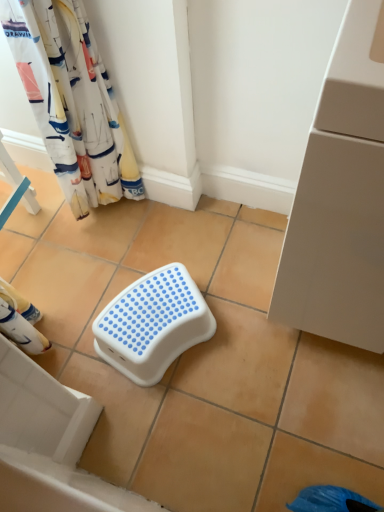
Question: Is white plastic step stool at center bigger or smaller than white fabric curtain at upper left?

Choices:
 (A) big
 (B) small

Answer: (B)

Question: Would you say white plastic step stool at center is to the left or to the right of white fabric curtain at upper left in the picture?

Choices:
 (A) left
 (B) right

Answer: (B)

Question: Does point (165, 276) appear closer or farther from the camera than point (4, 15)?

Choices:
 (A) closer
 (B) farther

Answer: (B)

Question: From a real-world perspective, is white fabric curtain at upper left positioned above or below white plastic step stool at center?

Choices:
 (A) above
 (B) below

Answer: (A)

Question: Looking at their shapes, would you say white fabric curtain at upper left is wider or thinner than white plastic step stool at center?

Choices:
 (A) thin
 (B) wide

Answer: (A)

Question: Considering the positions of white fabric curtain at upper left and white plastic step stool at center in the image, is white fabric curtain at upper left bigger or smaller than white plastic step stool at center?

Choices:
 (A) big
 (B) small

Answer: (A)

Question: Considering the relative positions of white fabric curtain at upper left and white plastic step stool at center in the image provided, is white fabric curtain at upper left to the left or to the right of white plastic step stool at center?

Choices:
 (A) right
 (B) left

Answer: (B)